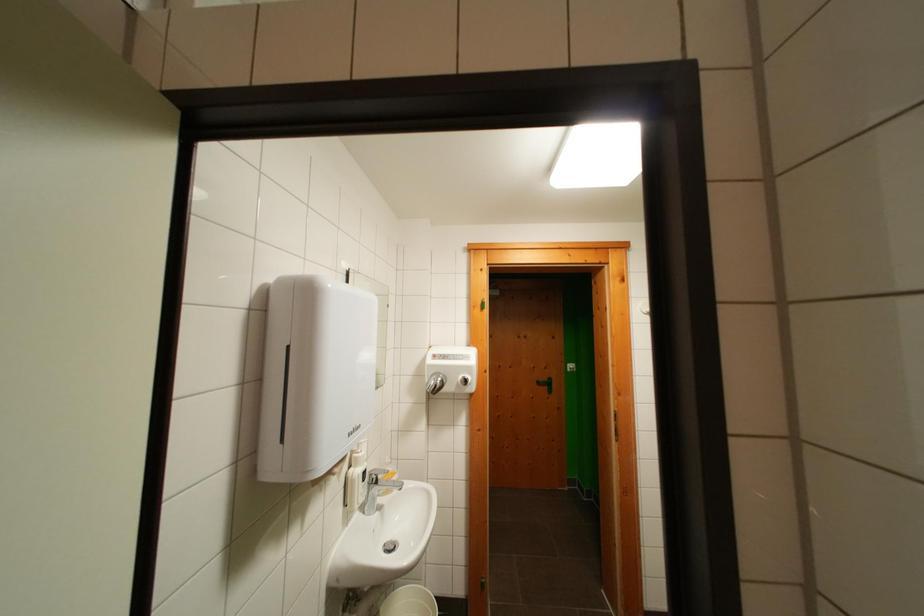
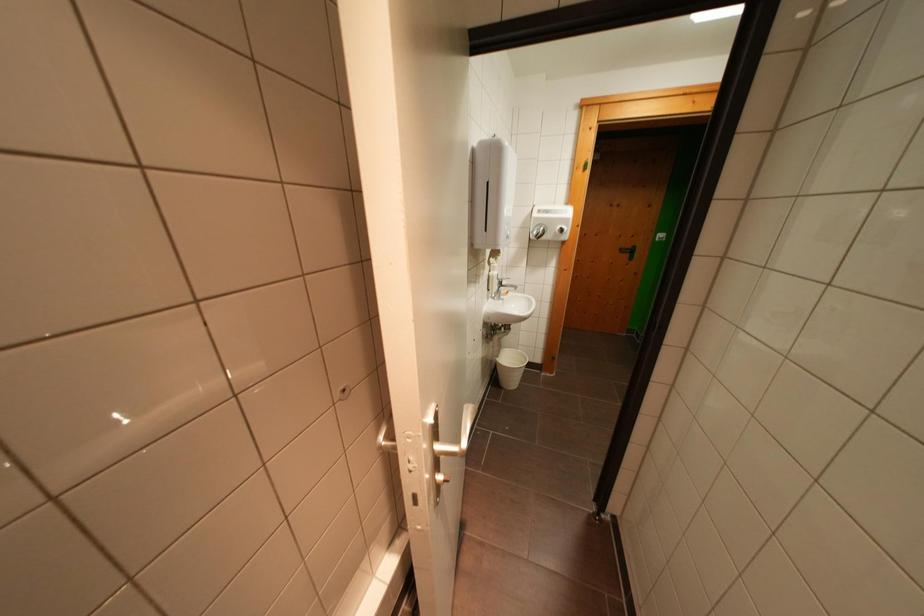
Find the pixel in the second image that matches point (359, 484) in the first image.

(500, 281)